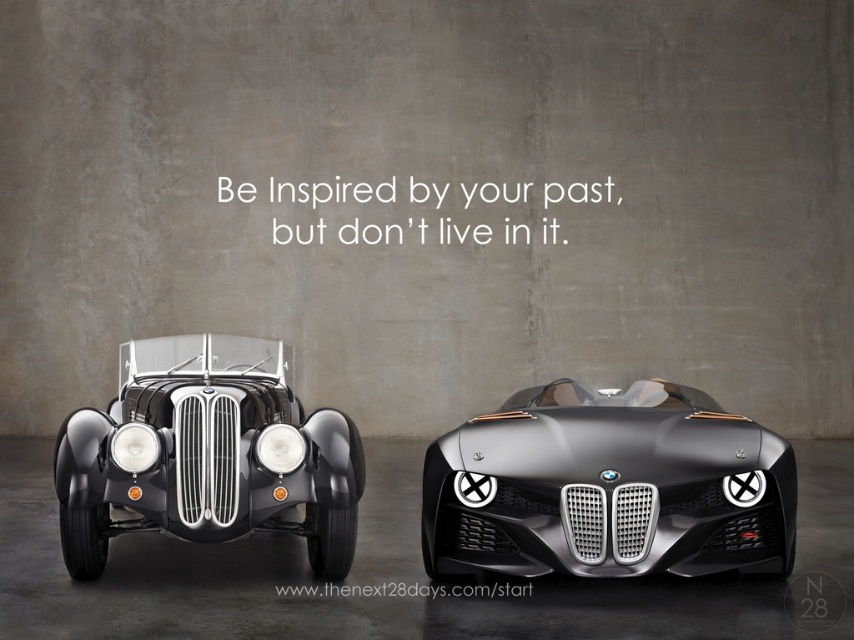
You are a photographer trying to capture both the shiny metallic sports car at center and the matte white headlight at left in a single shot. Since the camera can only focus on objects within a certain height range, which object should you prioritize to ensure it is in focus?

The shiny metallic sports car at center is much taller than the matte white headlight at left. Therefore, you should prioritize focusing on the shiny metallic sports car at center to ensure it is within the camera focus range.